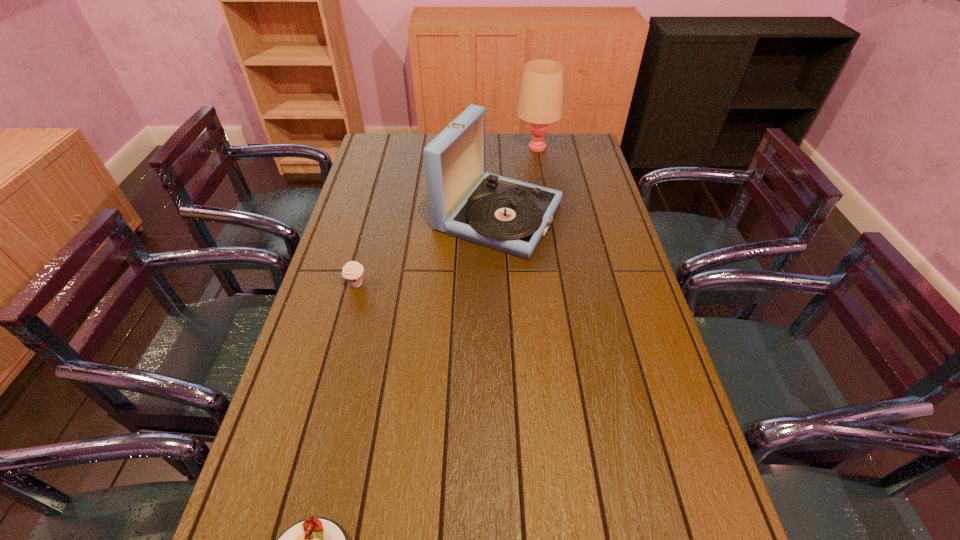
Find the location of a particular element. This screenshot has height=540, width=960. lampshade is located at coordinates (540, 102).

This screenshot has width=960, height=540. I want to click on phonograph record, so click(509, 215).

Find the location of `the second nearest object`. the second nearest object is located at coordinates (353, 272).

This screenshot has height=540, width=960. In order to click on the second shortest object in this screenshot , I will do `click(353, 272)`.

Find the location of `free space located 0.330m on the front of the lampshade`. free space located 0.330m on the front of the lampshade is located at coordinates (547, 209).

The height and width of the screenshot is (540, 960). Find the location of `free space located on the left of the second farthest object`. free space located on the left of the second farthest object is located at coordinates (397, 217).

Locate an element on the screen. This screenshot has width=960, height=540. vacant space located on the right of the second shortest object is located at coordinates (432, 284).

The width and height of the screenshot is (960, 540). Identify the location of object present at the far edge. tap(540, 102).

Where is `object located at the left edge`? object located at the left edge is located at coordinates (353, 272).

Where is `object at the right edge`? This screenshot has width=960, height=540. object at the right edge is located at coordinates (540, 102).